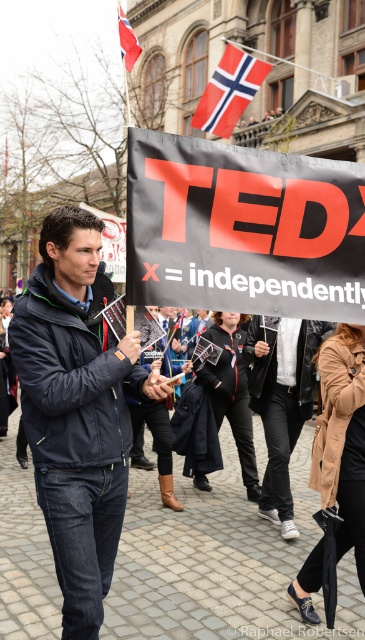
Looking at the scene, where is the red and white striped flag at upper center in relation to the red fabric flag at upper left?

The red and white striped flag at upper center is to the right of the red fabric flag at upper left.

Based on the scene described, which object is larger between the red and white striped flag at upper center and the red fabric flag at upper left?

The red and white striped flag at upper center is bigger than the red fabric flag at upper left.